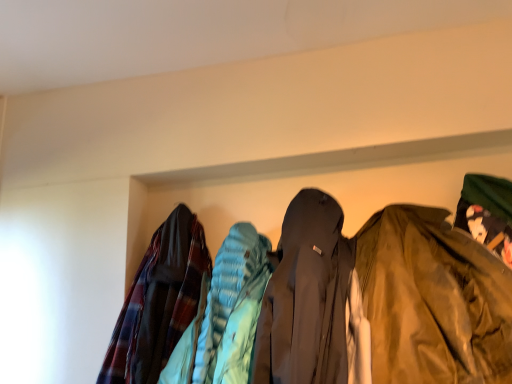
Question: Is shiny olive-green jacket at right, which ranks as the 1th jacket in right-to-left order, located within plaid fabric jacket at left, the first jacket from the left?

Choices:
 (A) no
 (B) yes

Answer: (A)

Question: From a real-world perspective, is plaid fabric jacket at left, marked as the second jacket in a right-to-left arrangement, located beneath shiny olive-green jacket at right, which ranks as the 1th jacket in right-to-left order?

Choices:
 (A) yes
 (B) no

Answer: (B)

Question: Are plaid fabric jacket at left, marked as the second jacket in a right-to-left arrangement, and shiny olive-green jacket at right, which ranks as the 1th jacket in right-to-left order, located far from each other?

Choices:
 (A) yes
 (B) no

Answer: (B)

Question: Is plaid fabric jacket at left, marked as the second jacket in a right-to-left arrangement, further to camera compared to shiny olive-green jacket at right, which ranks as the 1th jacket in right-to-left order?

Choices:
 (A) yes
 (B) no

Answer: (A)

Question: Is plaid fabric jacket at left, the first jacket from the left, shorter than shiny olive-green jacket at right, which ranks as the 1th jacket in right-to-left order?

Choices:
 (A) no
 (B) yes

Answer: (A)

Question: Is plaid fabric jacket at left, marked as the second jacket in a right-to-left arrangement, at the right side of shiny olive-green jacket at right, which ranks as the 1th jacket in right-to-left order?

Choices:
 (A) yes
 (B) no

Answer: (B)

Question: Would you say shiny olive-green jacket at right, which appears as the second jacket when viewed from the left, is outside plaid fabric jacket at left, marked as the second jacket in a right-to-left arrangement?

Choices:
 (A) yes
 (B) no

Answer: (A)

Question: Can you confirm if shiny olive-green jacket at right, which appears as the second jacket when viewed from the left, is smaller than plaid fabric jacket at left, marked as the second jacket in a right-to-left arrangement?

Choices:
 (A) yes
 (B) no

Answer: (B)

Question: Can you confirm if shiny olive-green jacket at right, which ranks as the 1th jacket in right-to-left order, is taller than plaid fabric jacket at left, the first jacket from the left?

Choices:
 (A) yes
 (B) no

Answer: (B)

Question: Is shiny olive-green jacket at right, which ranks as the 1th jacket in right-to-left order, far away from plaid fabric jacket at left, the first jacket from the left?

Choices:
 (A) yes
 (B) no

Answer: (B)

Question: Is shiny olive-green jacket at right, which ranks as the 1th jacket in right-to-left order, positioned before plaid fabric jacket at left, the first jacket from the left?

Choices:
 (A) no
 (B) yes

Answer: (B)

Question: Considering the relative sizes of shiny olive-green jacket at right, which appears as the second jacket when viewed from the left, and plaid fabric jacket at left, the first jacket from the left, in the image provided, is shiny olive-green jacket at right, which appears as the second jacket when viewed from the left, bigger than plaid fabric jacket at left, the first jacket from the left,?

Choices:
 (A) no
 (B) yes

Answer: (B)

Question: Is point coord(152,342) positioned closer to the camera than point coord(487,319)?

Choices:
 (A) closer
 (B) farther

Answer: (B)